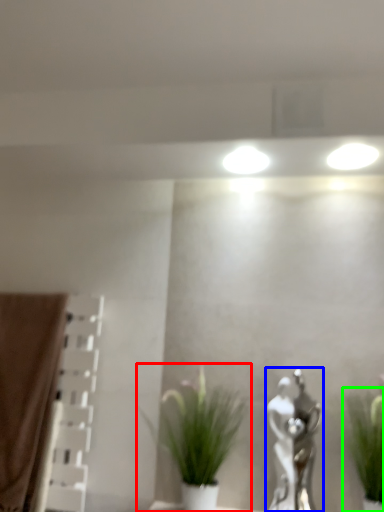
Question: Which is nearer to the houseplant (highlighted by a red box)? art (highlighted by a blue box) or houseplant (highlighted by a green box).

Choices:
 (A) art
 (B) houseplant

Answer: (A)